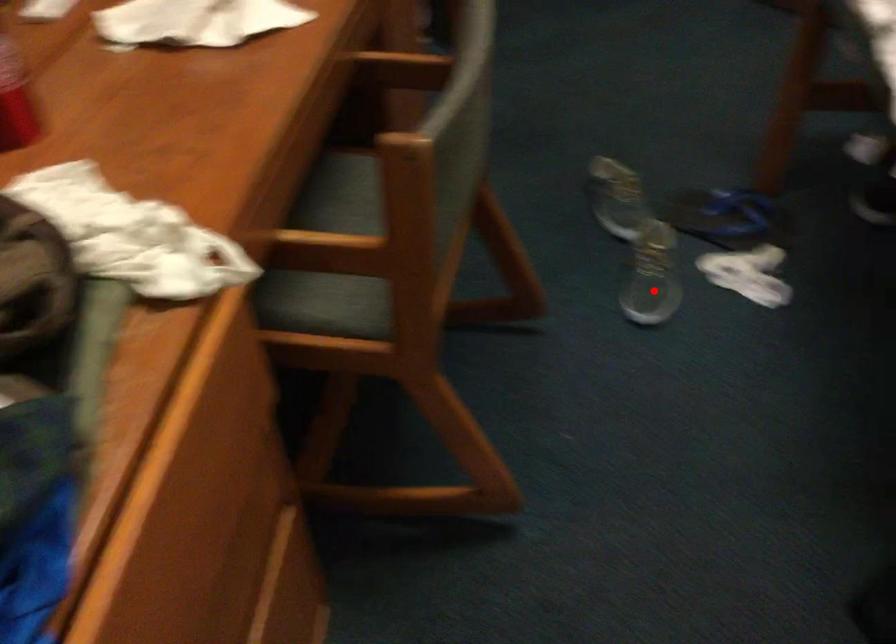
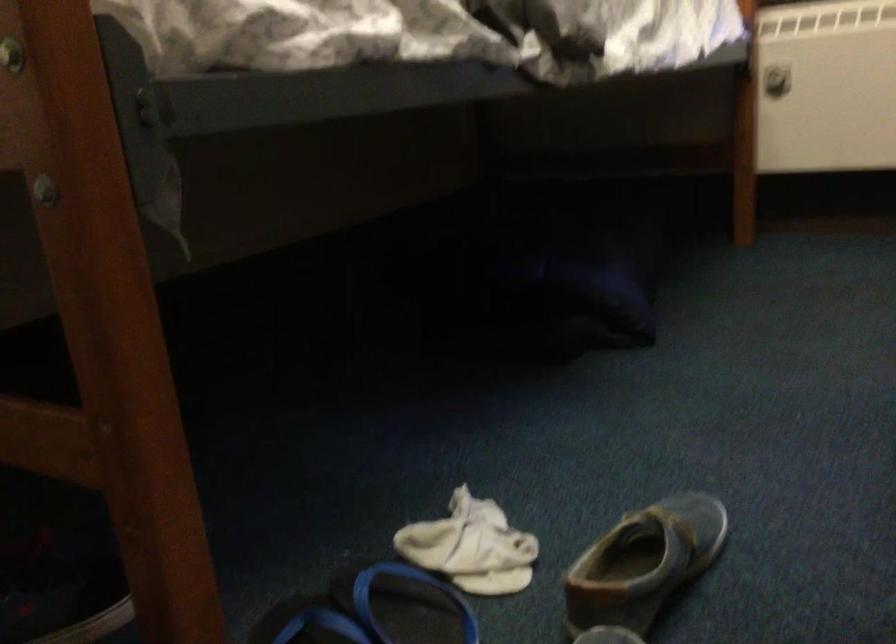
Question: I am providing you with two images of the same scene from different viewpoints. Given a red point in image1, look at the same physical point in image2. Is it:

Choices:
 (A) Closer to the viewpoint
 (B) Farther from the viewpoint

Answer: (A)